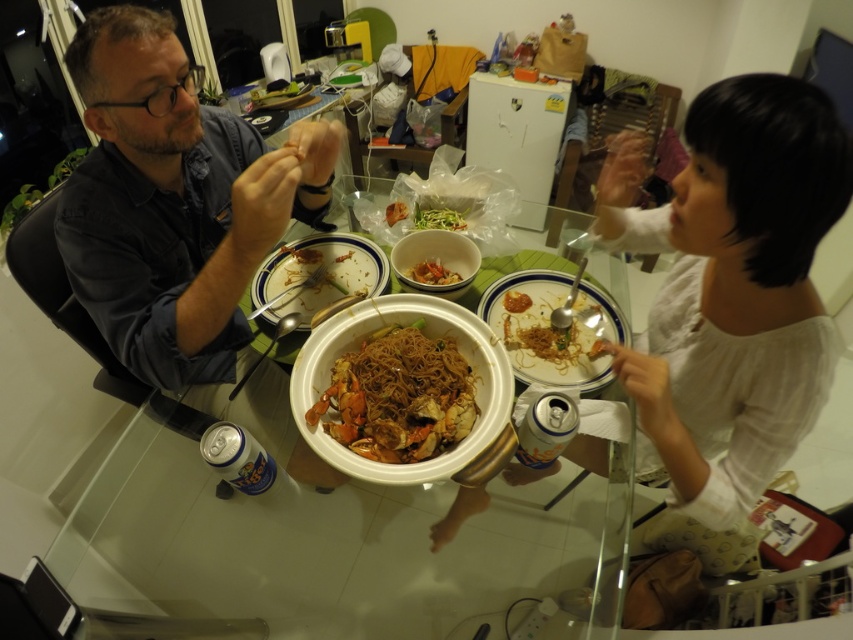
You are standing in the dining area and see the point marked at coordinates (173, 202). What object is located at that point?

The matte black shirt at left is located at point (173, 202).

You are a guest at this dinner and want to reach for the white matte bowl at center to serve yourself. Considering your position relative to the table, which direction should you move to access the bowl?

The white matte bowl at center is located at point (434,262), so you should move towards the center of the table to reach it.

You are a guest at this dinner and want to reach for the shiny orange crab at center. Which side of the matte black shirt at left should you approach from?

The shiny orange crab at center is to the right of the matte black shirt at left, so you should approach from the right side of the matte black shirt at left to reach it.